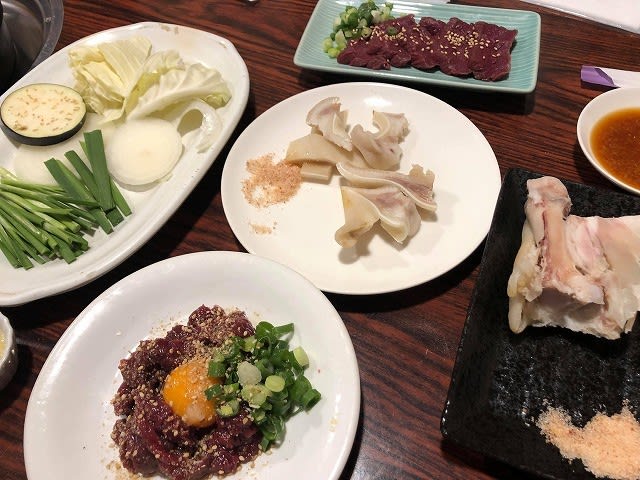
Locate an element on the screen. Image resolution: width=640 pixels, height=480 pixels. plate is located at coordinates (340, 408).